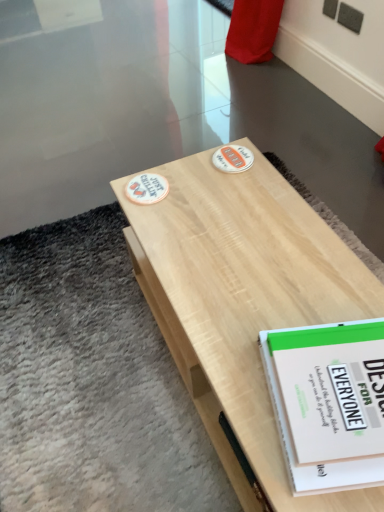
This screenshot has width=384, height=512. In order to click on light wood table at center in this screenshot , I will do `click(243, 301)`.

Describe the element at coordinates (243, 301) in the screenshot. I see `light wood table at center` at that location.

What is the approximate height of light wood table at center?

light wood table at center is 15.99 inches tall.

What do you see at coordinates (328, 402) in the screenshot?
I see `white paper book at center` at bounding box center [328, 402].

Find the location of a particular element. This screenshot has width=384, height=512. white paper book at center is located at coordinates (328, 402).

What is the approximate width of white paper book at center?

white paper book at center is 9.84 inches wide.

You are a GUI agent. You are given a task and a screenshot of the screen. Output one action in this format:
    pyautogui.click(x=<x>, y=<y>)
    Task: Click on the light wood table at center
    
    Given the screenshot: What is the action you would take?
    pyautogui.click(x=243, y=301)

Considering the positions of objects white paper book at center and light wood table at center in the image provided, who is more to the right, white paper book at center or light wood table at center?

white paper book at center.

In the image, is white paper book at center positioned in front of or behind light wood table at center?

Clearly, white paper book at center is behind light wood table at center.

Which is less distant, (295, 448) or (209, 155)?

The point (295, 448) is in front.

From the image's perspective, is white paper book at center below light wood table at center?

Yes.

From a real-world perspective, is white paper book at center positioned over light wood table at center based on gravity?

Yes, from a real-world perspective, white paper book at center is over light wood table at center

Can you confirm if white paper book at center is wider than light wood table at center?

No, white paper book at center is not wider than light wood table at center.

Between white paper book at center and light wood table at center, which one has less height?

Standing shorter between the two is white paper book at center.

Looking at this image, can you confirm if white paper book at center is smaller than light wood table at center?

Indeed, white paper book at center has a smaller size compared to light wood table at center.

Is light wood table at center a part of white paper book at center?

Actually, light wood table at center is outside white paper book at center.

Are white paper book at center and light wood table at center beside each other?

No.

Could you tell me if white paper book at center is turned towards light wood table at center?

No, white paper book at center is not oriented towards light wood table at center.

How many degrees apart are the facing directions of white paper book at center and light wood table at center?

They differ by 75.2 degrees in their facing directions.

You are a GUI agent. You are given a task and a screenshot of the screen. Output one action in this format:
    pyautogui.click(x=<x>, y=<y>)
    Task: Click on the book behind the light wood table at center
    
    Given the screenshot: What is the action you would take?
    pyautogui.click(x=328, y=402)

Is light wood table at center to the right of white paper book at center from the viewer's perspective?

No.

Between light wood table at center and white paper book at center, which one is positioned in front?

light wood table at center is closer to the camera.

Is point (275, 181) farther from camera compared to point (298, 329)?

That is True.

From the image's perspective, is light wood table at center located above or below white paper book at center?

Based on their image positions, light wood table at center is located above white paper book at center.

From a real-world perspective, is light wood table at center physically above white paper book at center?

No, from a real-world perspective, light wood table at center is not over white paper book at center

In terms of width, does light wood table at center look wider or thinner when compared to white paper book at center?

light wood table at center is wider than white paper book at center.

Considering the relative sizes of light wood table at center and white paper book at center in the image provided, is light wood table at center taller than white paper book at center?

Yes, light wood table at center is taller than white paper book at center.

Can you confirm if light wood table at center is smaller than white paper book at center?

Incorrect, light wood table at center is not smaller in size than white paper book at center.

Is light wood table at center not within white paper book at center?

Indeed, light wood table at center is completely outside white paper book at center.

Is light wood table at center directly adjacent to white paper book at center?

light wood table at center is not next to white paper book at center, and they're not touching.

Is light wood table at center positioned with its back to white paper book at center?

No, light wood table at center's orientation is not away from white paper book at center.

How different are the orientations of light wood table at center and white paper book at center in degrees?

light wood table at center and white paper book at center are facing 75.2 degrees away from each other.

Find the location of a particular element. table below the white paper book at center (from a real-world perspective) is located at coordinates (243, 301).

Image resolution: width=384 pixels, height=512 pixels. I want to click on book above the light wood table at center (from a real-world perspective), so tap(328, 402).

This screenshot has width=384, height=512. I want to click on table that is under the white paper book at center (from a real-world perspective), so click(243, 301).